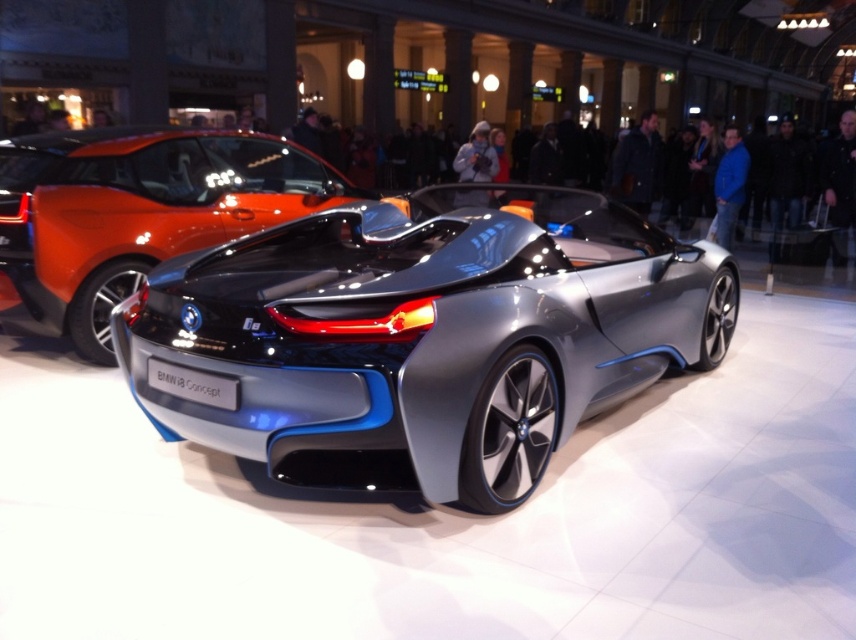
Between point (640, 230) and point (19, 176), which one is positioned in front?

Positioned in front is point (640, 230).

Does sleek metallic car at center appear over shiny metallic car at center?

Actually, sleek metallic car at center is below shiny metallic car at center.

This screenshot has height=640, width=856. Identify the location of sleek metallic car at center. (421, 337).